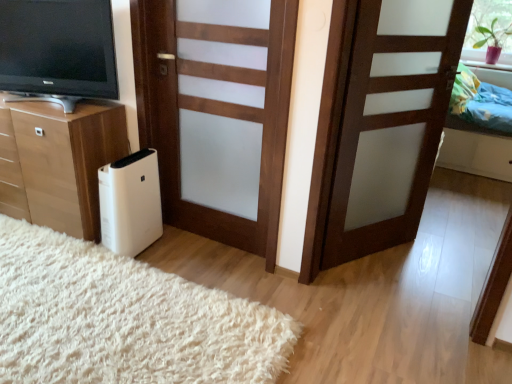
Where is `vacant space underneath brown matte door at center, which appears as the first door when viewed from the right (from a real-world perspective)`? The image size is (512, 384). vacant space underneath brown matte door at center, which appears as the first door when viewed from the right (from a real-world perspective) is located at coordinates (360, 260).